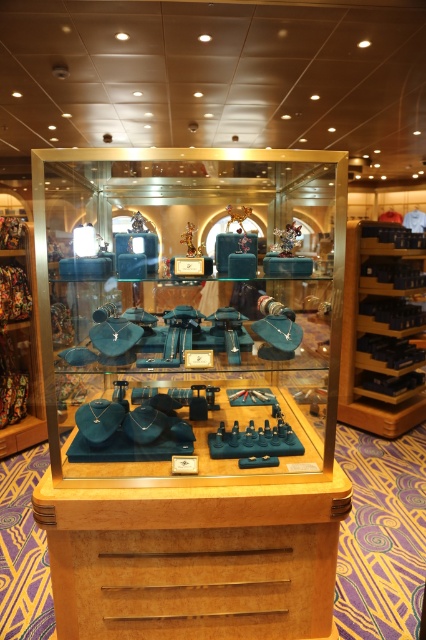
Based on the photo, you are a customer looking at the jewelry display case. You see a matte blue jewelry box at center and a matte blue figurine at center. Which one is closer to you?

The matte blue jewelry box at center is closer to the viewer than the matte blue figurine at center.

Consider the image. You are a customer standing in front of the jewelry display case. You want to pick up the matte blue jewelry box at center to examine it closely. Considering your average height, can you reach it without needing a stool?

The matte blue jewelry box at center is 1.62 meters from the camera. Since the average human height is around 1.6 to 1.7 meters, you would need to stand on your tiptoes or use a stool to reach it comfortably.

You are a customer standing in front of the jewelry display case. You notice two points inside the case labeled as point (138,268) and point (275,234). Which of these points is closer to you?

Point (138,268) is in front of point (275,234), so it is closer to you.